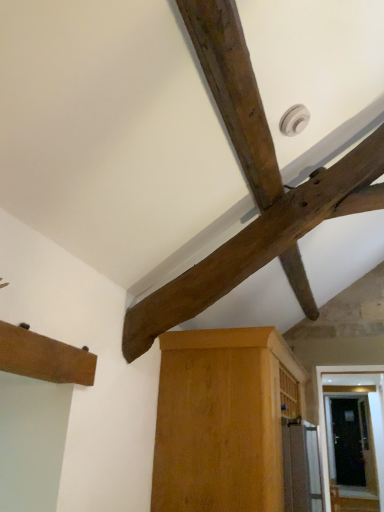
Question: Can you confirm if light brown wood cabinet at center, positioned as the 2th cabinetry in top-to-bottom order, is bigger than brown wood cabinet at lower left, the 2th cabinetry ordered from the bottom?

Choices:
 (A) yes
 (B) no

Answer: (A)

Question: Is light brown wood cabinet at center, which appears as the first cabinetry when viewed from the right, taller than brown wood cabinet at lower left, the first cabinetry from the top?

Choices:
 (A) yes
 (B) no

Answer: (A)

Question: Is light brown wood cabinet at center, positioned as the 2th cabinetry in top-to-bottom order, positioned beyond the bounds of brown wood cabinet at lower left, the second cabinetry positioned from the back?

Choices:
 (A) no
 (B) yes

Answer: (B)

Question: Does light brown wood cabinet at center, marked as the 1th cabinetry in a back-to-front arrangement, appear on the right side of brown wood cabinet at lower left, the 2th cabinetry from the right?

Choices:
 (A) yes
 (B) no

Answer: (A)

Question: Is light brown wood cabinet at center, marked as the 1th cabinetry in a back-to-front arrangement, closer to camera compared to brown wood cabinet at lower left, the first cabinetry viewed from the left?

Choices:
 (A) no
 (B) yes

Answer: (A)

Question: Does point (56, 370) appear closer or farther from the camera than point (185, 506)?

Choices:
 (A) farther
 (B) closer

Answer: (B)

Question: Looking at their shapes, would you say brown wood cabinet at lower left, the second cabinetry positioned from the back, is wider or thinner than light brown wood cabinet at center, the second cabinetry from the left?

Choices:
 (A) wide
 (B) thin

Answer: (B)

Question: Is brown wood cabinet at lower left, the first cabinetry in the front-to-back sequence, situated inside light brown wood cabinet at center, which ranks as the second cabinetry in front-to-back order, or outside?

Choices:
 (A) inside
 (B) outside

Answer: (B)

Question: Considering the relative positions of brown wood cabinet at lower left, the 2th cabinetry ordered from the bottom, and light brown wood cabinet at center, which appears as the first cabinetry when viewed from the right, in the image provided, is brown wood cabinet at lower left, the 2th cabinetry ordered from the bottom, to the left or to the right of light brown wood cabinet at center, which appears as the first cabinetry when viewed from the right,?

Choices:
 (A) left
 (B) right

Answer: (A)

Question: Is dark brown wood beam at upper center to the left or to the right of brown wood cabinet at lower left, the 2th cabinetry from the right, in the image?

Choices:
 (A) right
 (B) left

Answer: (A)

Question: From the image's perspective, relative to brown wood cabinet at lower left, the 2th cabinetry from the right, is dark brown wood beam at upper center above or below?

Choices:
 (A) below
 (B) above

Answer: (B)

Question: Is dark brown wood beam at upper center inside or outside of brown wood cabinet at lower left, the 2th cabinetry from the right?

Choices:
 (A) inside
 (B) outside

Answer: (B)

Question: In the image, is dark brown wood beam at upper center positioned in front of or behind brown wood cabinet at lower left, the first cabinetry viewed from the left?

Choices:
 (A) front
 (B) behind

Answer: (B)

Question: Which is correct: light brown wood cabinet at center, positioned as the 2th cabinetry in top-to-bottom order, is inside dark brown wood beam at upper center, or outside of it?

Choices:
 (A) outside
 (B) inside

Answer: (A)

Question: Visually, is light brown wood cabinet at center, the second cabinetry from the left, positioned to the left or to the right of dark brown wood beam at upper center?

Choices:
 (A) right
 (B) left

Answer: (A)